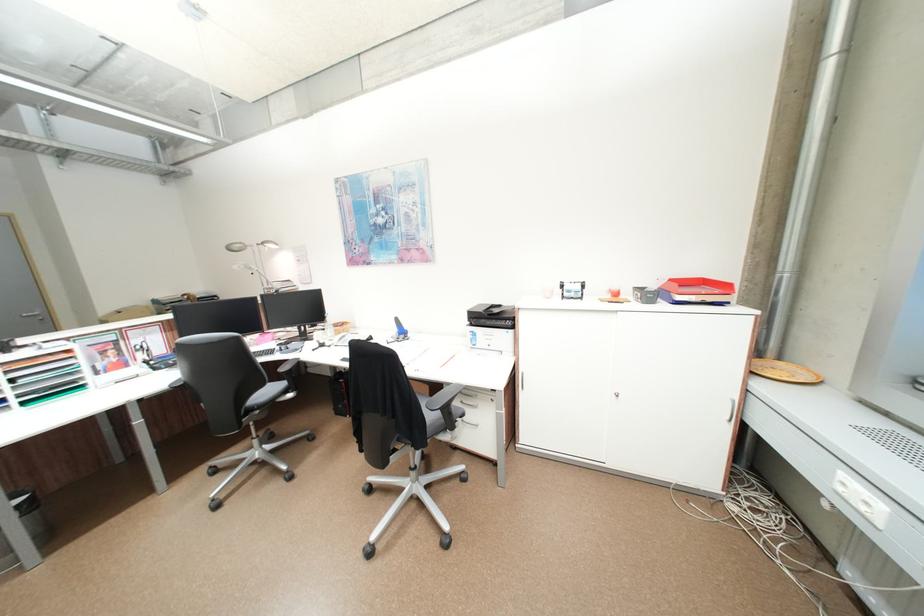
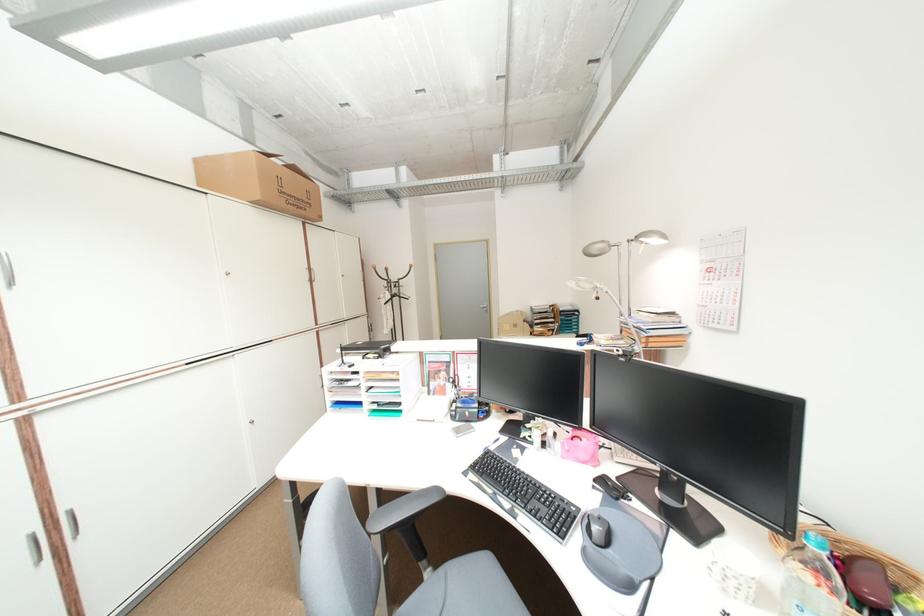
Question: I am providing you with two images of the same scene from different viewpoints. Please identify which objects are invisible in image2.

Choices:
 (A) door handle
 (B) small red lantern
 (C) trash can
 (D) computer mouse

Answer: (C)